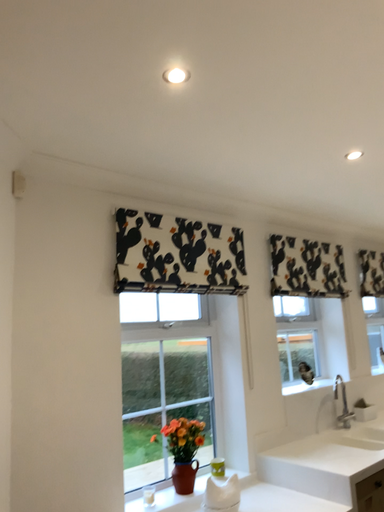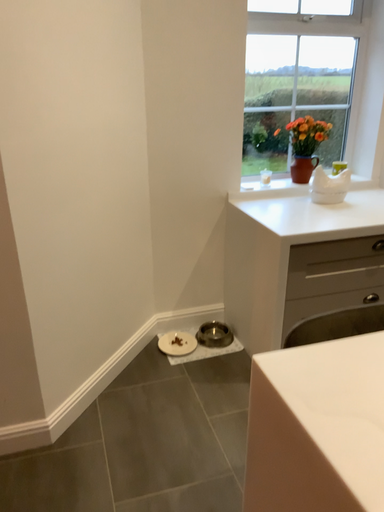
Question: Which way did the camera rotate in the video?

Choices:
 (A) rotated right
 (B) rotated left

Answer: (B)